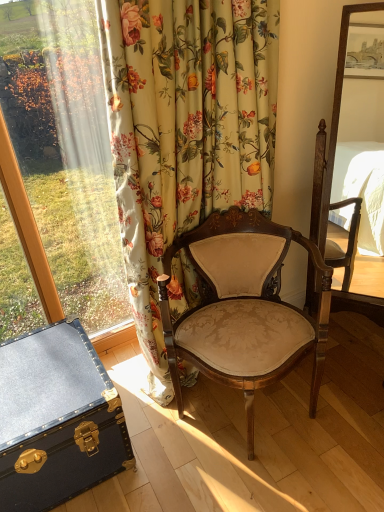
Question: Considering the relative sizes of blue leather trunk at lower left and floral fabric curtain at left in the image provided, is blue leather trunk at lower left wider than floral fabric curtain at left?

Choices:
 (A) no
 (B) yes

Answer: (B)

Question: Is blue leather trunk at lower left shorter than floral fabric curtain at left?

Choices:
 (A) no
 (B) yes

Answer: (B)

Question: Is blue leather trunk at lower left thinner than floral fabric curtain at left?

Choices:
 (A) yes
 (B) no

Answer: (B)

Question: Is blue leather trunk at lower left not inside floral fabric curtain at left?

Choices:
 (A) no
 (B) yes

Answer: (B)

Question: From the image's perspective, is blue leather trunk at lower left below floral fabric curtain at left?

Choices:
 (A) no
 (B) yes

Answer: (B)

Question: Considering the relative sizes of blue leather trunk at lower left and floral fabric curtain at left in the image provided, is blue leather trunk at lower left smaller than floral fabric curtain at left?

Choices:
 (A) yes
 (B) no

Answer: (A)

Question: Is floral fabric curtain at left closer to camera compared to matte beige fabric chair at center?

Choices:
 (A) yes
 (B) no

Answer: (A)

Question: From the image's perspective, would you say floral fabric curtain at left is shown under matte beige fabric chair at center?

Choices:
 (A) no
 (B) yes

Answer: (A)

Question: Could you tell me if floral fabric curtain at left is facing matte beige fabric chair at center?

Choices:
 (A) no
 (B) yes

Answer: (B)

Question: Considering the relative sizes of floral fabric curtain at left and matte beige fabric chair at center in the image provided, is floral fabric curtain at left smaller than matte beige fabric chair at center?

Choices:
 (A) no
 (B) yes

Answer: (B)

Question: From the image's perspective, is floral fabric curtain at left on matte beige fabric chair at center?

Choices:
 (A) yes
 (B) no

Answer: (A)

Question: From a real-world perspective, is floral fabric curtain at left positioned under matte beige fabric chair at center based on gravity?

Choices:
 (A) yes
 (B) no

Answer: (B)

Question: Is floral fabric curtain at left surrounding blue leather trunk at lower left?

Choices:
 (A) yes
 (B) no

Answer: (B)